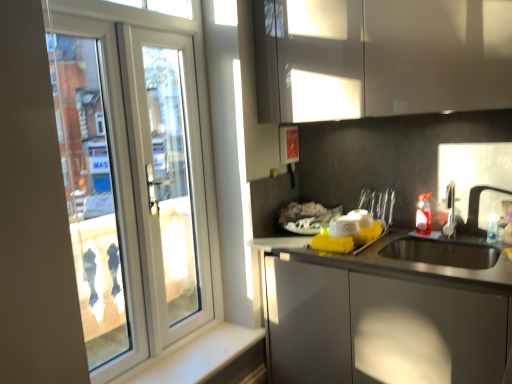
Measure the distance between glossy white cabinet at upper center and camera.

glossy white cabinet at upper center is 5.04 feet from camera.

In the scene shown: What is the approximate width of white plastic door at left?

white plastic door at left is 1.78 inches wide.

This screenshot has height=384, width=512. I want to click on white smooth window sill at lower left, so click(195, 355).

In order to click on satin nickel faucet at sink right in this screenshot , I will do `click(450, 211)`.

Is glossy white cabinet at upper center facing towards white plastic door at left?

No, glossy white cabinet at upper center is not aimed at white plastic door at left.

What's the angular difference between glossy white cabinet at upper center and white plastic door at left's facing directions?

The angular difference between glossy white cabinet at upper center and white plastic door at left is 90.6 degrees.

From a real-world perspective, does glossy white cabinet at upper center sit lower than white plastic door at left?

Actually, glossy white cabinet at upper center is physically above white plastic door at left in the real world.

From the image's perspective, would you say glossy white cabinet at upper center is shown under white plastic door at left?

No, from the image's perspective, glossy white cabinet at upper center is not beneath white plastic door at left.

Which object is positioned more to the left, white plastic door at left or white smooth window sill at lower left?

white plastic door at left is more to the left.

What's the angular difference between white plastic door at left and white smooth window sill at lower left's facing directions?

white plastic door at left and white smooth window sill at lower left are facing 0.489 degrees away from each other.

Is white plastic door at left completely or partially outside of white smooth window sill at lower left?

Absolutely, white plastic door at left is external to white smooth window sill at lower left.

Is the depth of white plastic door at left greater than that of white smooth window sill at lower left?

No, white plastic door at left is closer to the camera.

Looking at this image, does white plastic door at left come behind white plastic screen door at left?

No.

The height and width of the screenshot is (384, 512). Identify the location of screen door below the white plastic door at left (from a real-world perspective). (167, 181).

Can you tell me how much white plastic door at left and white plastic screen door at left differ in facing direction?

There is a 0.000923-degree angle between the facing directions of white plastic door at left and white plastic screen door at left.

From a real-world perspective, who is located lower, white plastic door at left or white plastic screen door at left?

white plastic screen door at left, from a real-world perspective.

Looking at this image, does glossy white cabinet at upper center have a lesser width compared to white plastic screen door at left?

No.

Can you tell me how much glossy white cabinet at upper center and white plastic screen door at left differ in facing direction?

The angle between the facing direction of glossy white cabinet at upper center and the facing direction of white plastic screen door at left is 90.6 degrees.

From a real-world perspective, is glossy white cabinet at upper center on white plastic screen door at left?

Yes, from a real-world perspective, glossy white cabinet at upper center is on top of white plastic screen door at left.

Is glossy white cabinet at upper center aimed at white plastic screen door at left?

No, glossy white cabinet at upper center is not aimed at white plastic screen door at left.

Is satin nickel faucet at sink right facing away from white plastic screen door at left?

satin nickel faucet at sink right is not turned away from white plastic screen door at left.

In the image, is satin nickel faucet at sink right on the left side or the right side of white plastic screen door at left?

Based on their positions, satin nickel faucet at sink right is located to the right of white plastic screen door at left.

Considering their positions, is satin nickel faucet at sink right located in front of or behind white plastic screen door at left?

satin nickel faucet at sink right is in front of white plastic screen door at left.

Which is closer to the camera, (449, 212) or (203, 172)?

Point (449, 212) is positioned closer to the camera compared to point (203, 172).

Is the surface of white plastic screen door at left in direct contact with white plastic door at left?

Indeed, white plastic screen door at left and white plastic door at left are beside each other and touching.

Would you say white plastic screen door at left is inside or outside white plastic door at left?

white plastic screen door at left is enclosed within white plastic door at left.

Could you tell me if white plastic screen door at left is facing white plastic door at left?

Yes, white plastic screen door at left is turned towards white plastic door at left.

Considering the relative sizes of white plastic screen door at left and white plastic door at left in the image provided, is white plastic screen door at left smaller than white plastic door at left?

Yes, white plastic screen door at left is smaller than white plastic door at left.

Is point (156, 206) farther from viewer compared to point (447, 225)?

No, (156, 206) is in front of (447, 225).

From the image's perspective, which one is positioned higher, white plastic screen door at left or satin nickel faucet at sink right?

white plastic screen door at left appears higher in the image.

Which of these two, white plastic screen door at left or satin nickel faucet at sink right, is thinner?

With smaller width is white plastic screen door at left.

Based on the photo, is white plastic screen door at left situated inside satin nickel faucet at sink right or outside?

white plastic screen door at left exists outside the volume of satin nickel faucet at sink right.

I want to click on door lying behind the glossy white cabinet at upper center, so click(x=136, y=176).

The height and width of the screenshot is (384, 512). In order to click on window sill on the right of the white plastic door at left in this screenshot , I will do [x=195, y=355].

Based on their spatial positions, is white smooth window sill at lower left or glossy white cabinet at upper center further from satin nickel faucet at sink right?

Based on the image, white smooth window sill at lower left appears to be further to satin nickel faucet at sink right.

Looking at this image, considering their positions, is glossy white cabinet at upper center positioned closer to white smooth window sill at lower left than white plastic door at left?

Among the two, white plastic door at left is located nearer to white smooth window sill at lower left.

When comparing their distances from glossy white cabinet at upper center, does satin nickel faucet at sink right or white plastic screen door at left seem further?

The object further to glossy white cabinet at upper center is satin nickel faucet at sink right.

Considering their positions, is white plastic door at left positioned further to satin nickel faucet at sink right than white plastic screen door at left?

white plastic door at left is further to satin nickel faucet at sink right.

Looking at the image, which one is located closer to satin nickel faucet at sink right, white plastic screen door at left or white plastic door at left?

white plastic screen door at left is closer to satin nickel faucet at sink right.

From the image, which object appears to be nearer to white plastic door at left, glossy white cabinet at upper center or white plastic screen door at left?

white plastic screen door at left.

From the image, which object appears to be nearer to white plastic door at left, white plastic screen door at left or glossy white cabinet at upper center?

white plastic screen door at left.

Which object lies nearer to the anchor point white plastic door at left, satin nickel faucet at sink right or white plastic screen door at left?

white plastic screen door at left lies closer to white plastic door at left than the other object.

Identify the location of cabinetry between white plastic screen door at left and satin nickel faucet at sink right in the horizontal direction. (380, 57).

This screenshot has width=512, height=384. What are the coordinates of `screen door between white plastic door at left and white smooth window sill at lower left in the vertical direction` in the screenshot? It's located at click(x=167, y=181).

Where is `screen door situated between white plastic door at left and glossy white cabinet at upper center from left to right`? screen door situated between white plastic door at left and glossy white cabinet at upper center from left to right is located at coordinates (167, 181).

What are the coordinates of `tap between glossy white cabinet at upper center and white smooth window sill at lower left from top to bottom` in the screenshot? It's located at pyautogui.click(x=450, y=211).